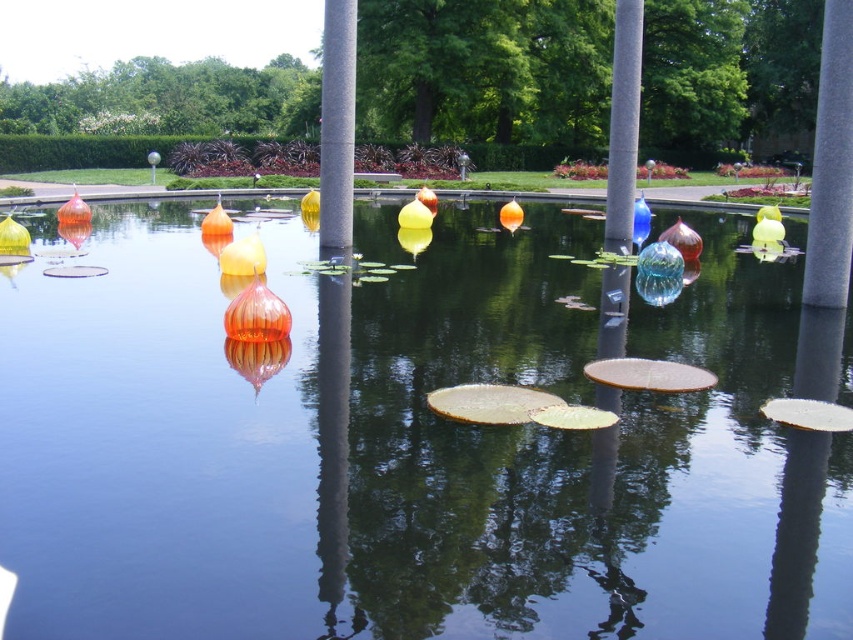
In the scene shown: How far apart are translucent glass orbs at center and gray stone pole at center?

They are 3.92 meters apart.

Which is more to the left, translucent glass orbs at center or gray stone pole at center?

From the viewer's perspective, gray stone pole at center appears more on the left side.

You are a GUI agent. You are given a task and a screenshot of the screen. Output one action in this format:
    pyautogui.click(x=<x>, y=<y>)
    Task: Click on the translucent glass orbs at center
    This screenshot has width=853, height=640.
    Given the screenshot: What is the action you would take?
    (412, 440)